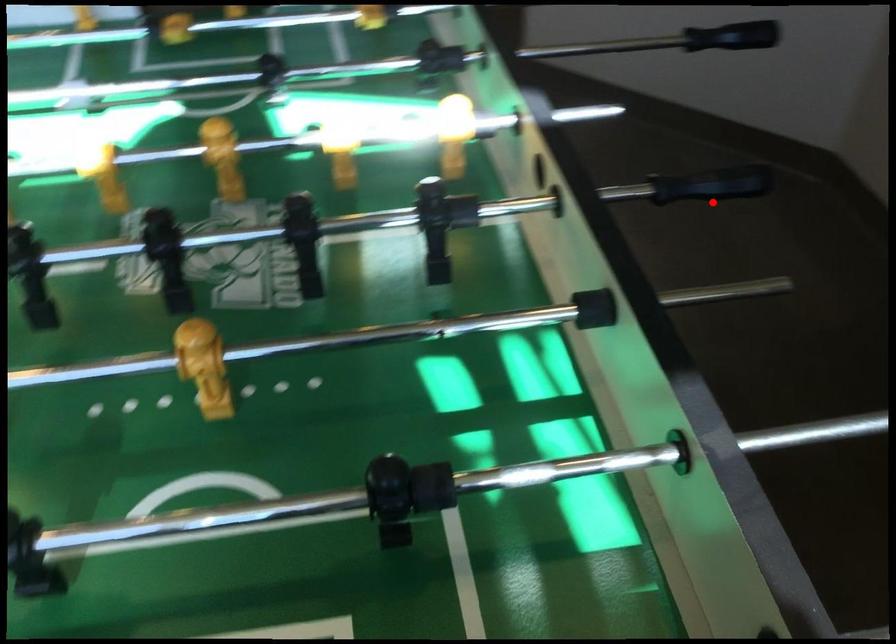
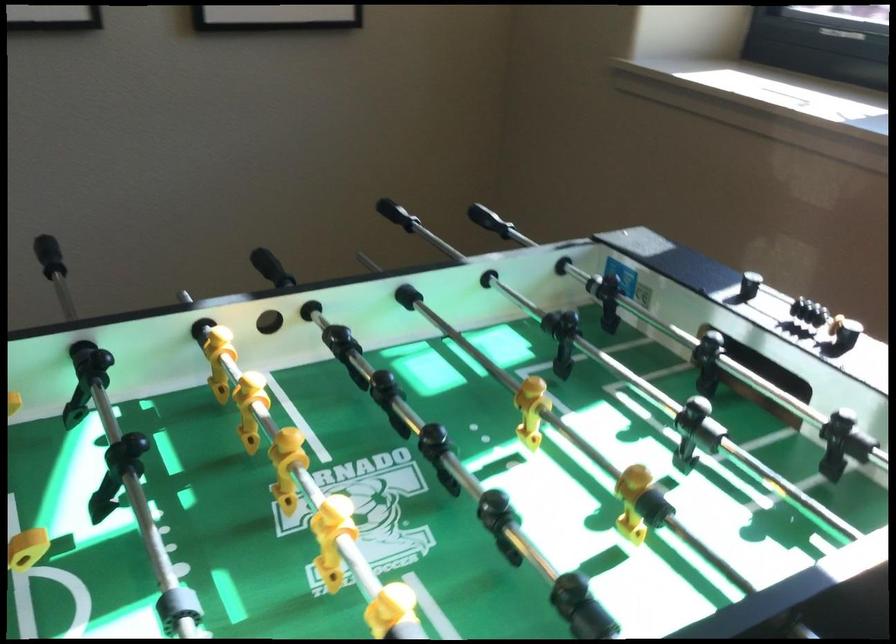
Find the pixel in the second image that matches the highlighted location in the first image.

(271, 268)